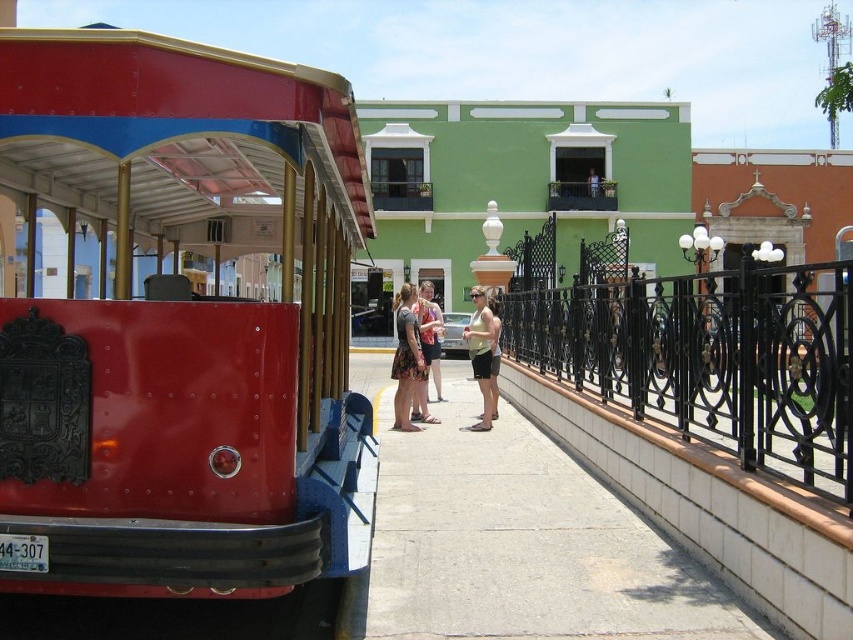
Is the position of matte yellow tank top at center more distant than that of matte pink dress at center?

Yes.

Who is positioned more to the left, matte yellow tank top at center or matte pink dress at center?

Positioned to the left is matte pink dress at center.

Find the location of a particular element. This screenshot has height=640, width=853. matte yellow tank top at center is located at coordinates click(482, 353).

Can you confirm if gray concrete pavement at center is positioned to the left of matte yellow tank top at center?

Correct, you'll find gray concrete pavement at center to the left of matte yellow tank top at center.

Between gray concrete pavement at center and matte yellow tank top at center, which one has more height?

matte yellow tank top at center is taller.

Is point (653, 588) more distant than point (471, 355)?

No, (653, 588) is in front of (471, 355).

You are a GUI agent. You are given a task and a screenshot of the screen. Output one action in this format:
    pyautogui.click(x=<x>, y=<y>)
    Task: Click on the gray concrete pavement at center
    This screenshot has width=853, height=640.
    Given the screenshot: What is the action you would take?
    pyautogui.click(x=518, y=545)

Can you confirm if metallic red trolley at left is wider than matte pink dress at center?

Yes.

Locate an element on the screen. This screenshot has width=853, height=640. metallic red trolley at left is located at coordinates (178, 321).